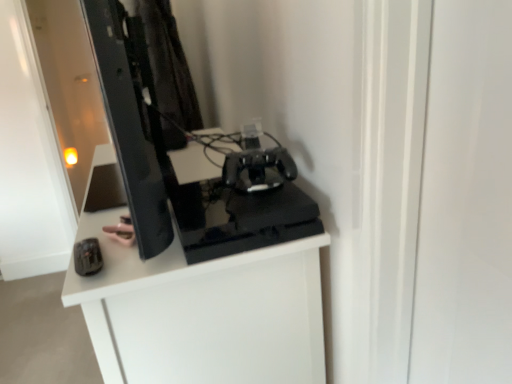
Describe the element at coordinates (202, 312) in the screenshot. I see `glossy black console at center` at that location.

In order to click on glossy black console at center in this screenshot , I will do `click(202, 312)`.

This screenshot has width=512, height=384. Find the location of `glossy black console at center`. glossy black console at center is located at coordinates (202, 312).